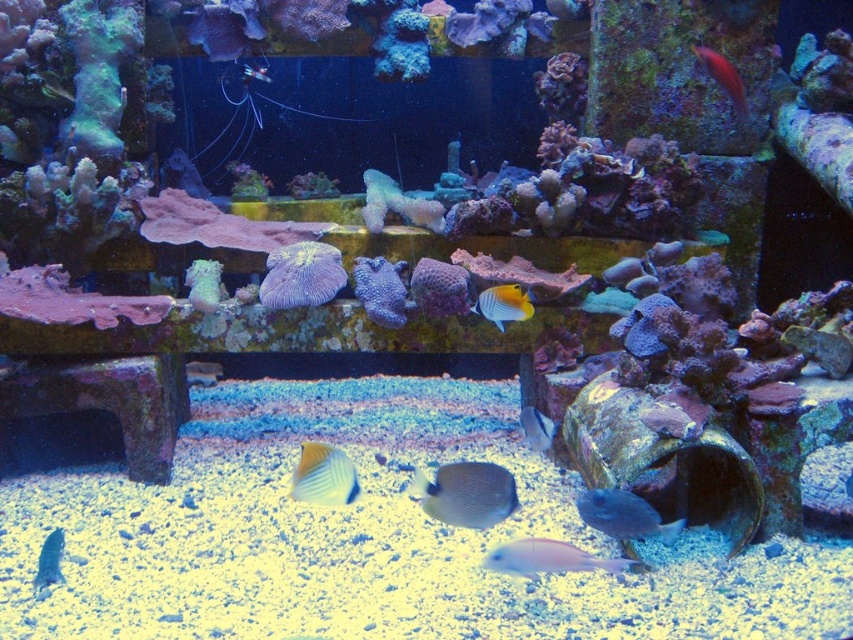
You are an aquatic biologist observing this underwater scene. You notice the gray matte fish at center and the blue glossy fish at lower left. Which fish has a greater width?

The gray matte fish at center has a greater width than the blue glossy fish at lower left, as stated in the description.

You are an underwater photographer aiming to capture a clear shot of the gray matte fish at center and the blue glossy fish at lower left. Which fish should you focus on first to ensure both are in focus without adjusting your camera settings?

You should focus on the gray matte fish at center first since it is closer to the viewer than the blue glossy fish at lower left. By focusing on the closer fish, the farther one may still be within the depth of field, allowing both to be in focus without adjusting the camera settings.

You are an underwater photographer aiming to capture a closeup shot of the white glossy fish at lower center. The camera you are using has a maximum focus range of 2 meters. Will you be able to focus on the fish without moving closer?

The white glossy fish at lower center is 2.46 meters away from the camera, which exceeds the maximum focus range of 2 meters. Therefore, you cannot focus on the fish without moving closer.